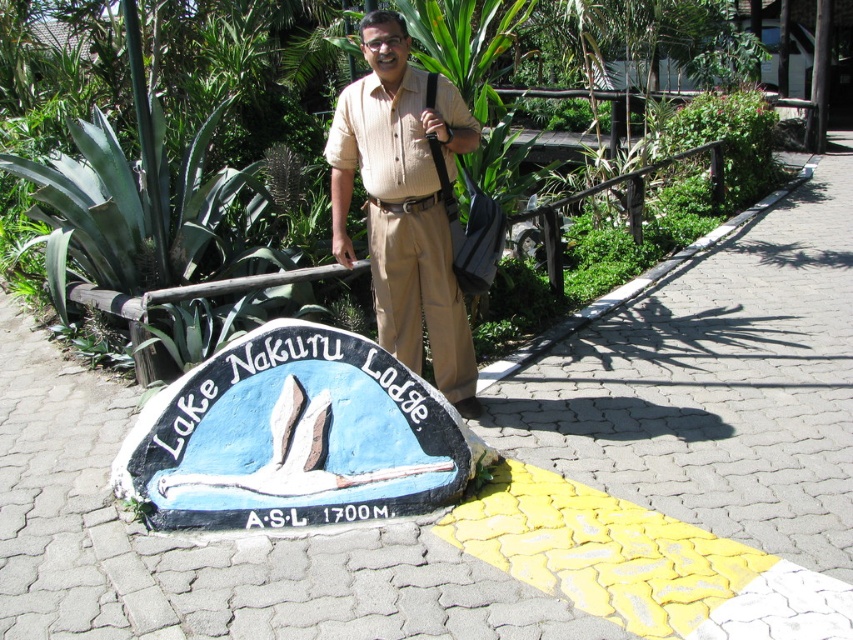
Who is higher up, blue painted stone lake nakuru lodge sign at center or beige striped shirt at center?

beige striped shirt at center is higher up.

Who is more distant from viewer, (x=210, y=486) or (x=393, y=348)?

The point (x=393, y=348) is behind.

Find the location of a particular element. The height and width of the screenshot is (640, 853). blue painted stone lake nakuru lodge sign at center is located at coordinates (293, 436).

Does blue painted stone lake nakuru lodge sign at center have a smaller size compared to green leafy plant at center?

Yes.

Does point (218, 492) lie behind point (148, 244)?

That is False.

This screenshot has width=853, height=640. I want to click on blue painted stone lake nakuru lodge sign at center, so click(293, 436).

Can you confirm if beige striped shirt at center is smaller than green leafy plant at center?

Indeed, beige striped shirt at center has a smaller size compared to green leafy plant at center.

Who is more forward, [422,305] or [155,136]?

Point [422,305]

The height and width of the screenshot is (640, 853). In order to click on beige striped shirt at center in this screenshot , I will do `click(404, 204)`.